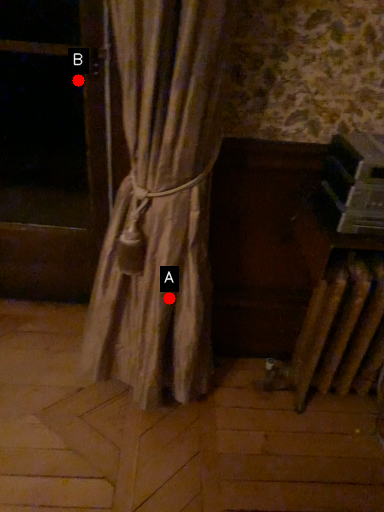
Question: Two points are circled on the image, labeled by A and B beside each circle. Which point is farther from the camera taking this photo?

Choices:
 (A) A is further
 (B) B is further

Answer: (B)